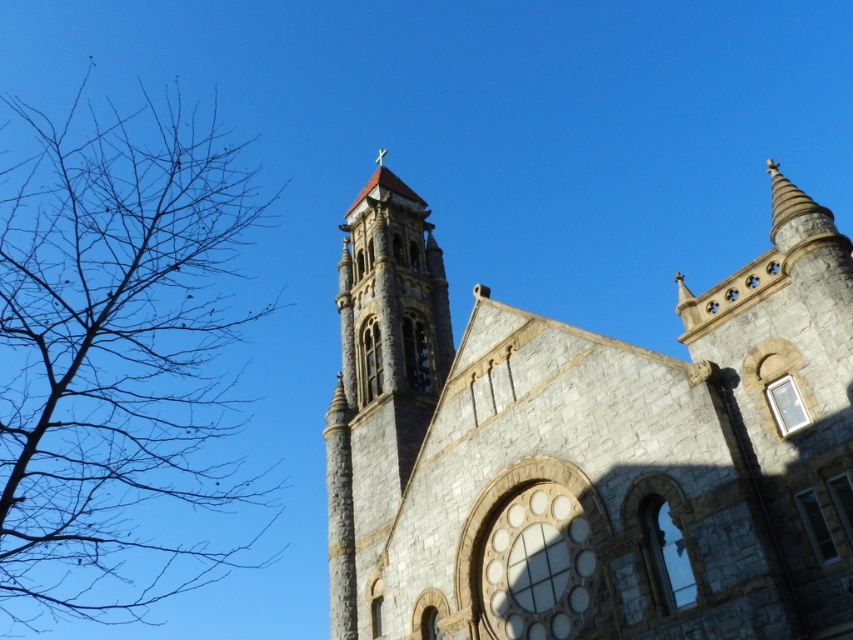
Question: Which object is farther from the camera taking this photo?

Choices:
 (A) stone church at center
 (B) brown bare branches at left
 (C) stone bell tower at center

Answer: (C)

Question: Does stone church at center appear over brown bare branches at left?

Choices:
 (A) no
 (B) yes

Answer: (A)

Question: Which object appears farthest from the camera in this image?

Choices:
 (A) stone church at center
 (B) stone bell tower at center

Answer: (B)

Question: Does brown bare branches at left appear on the left side of stone bell tower at center?

Choices:
 (A) no
 (B) yes

Answer: (B)

Question: Which object is positioned closest to the stone bell tower at center?

Choices:
 (A) stone church at center
 (B) brown bare branches at left

Answer: (A)

Question: Is stone church at center closer to the viewer compared to brown bare branches at left?

Choices:
 (A) no
 (B) yes

Answer: (A)